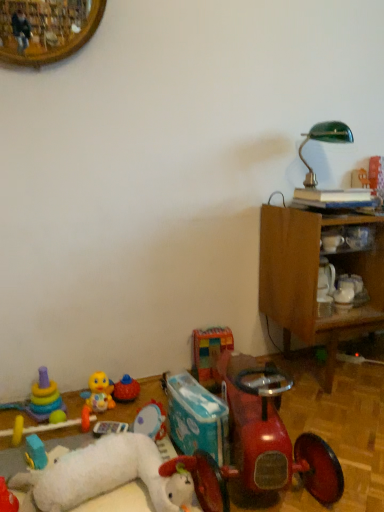
Where is `unoccupied area in front of multicolored plastic stacking rings at lower left, which is the 4th toy in left-to-right order`? The width and height of the screenshot is (384, 512). unoccupied area in front of multicolored plastic stacking rings at lower left, which is the 4th toy in left-to-right order is located at coordinates (28, 464).